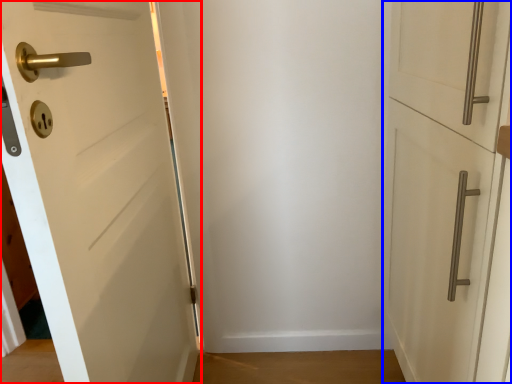
Question: Among these objects, which one is nearest to the camera, door (highlighted by a red box) or door (highlighted by a blue box)?

Choices:
 (A) door
 (B) door

Answer: (A)